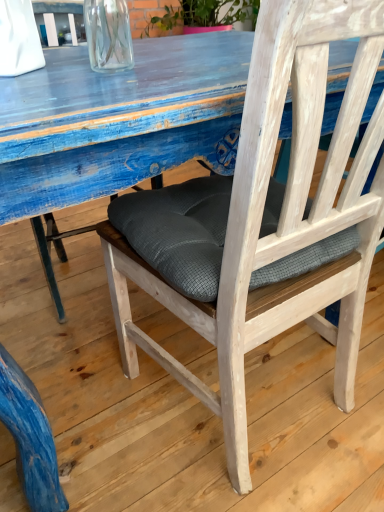
Measure the distance between point (313,224) and camera.

Point (313,224) is 26.10 inches away from camera.

Locate an element on the screen. The image size is (384, 512). wooden chair with cushion at center is located at coordinates (279, 215).

What do you see at coordinates (279, 215) in the screenshot?
I see `wooden chair with cushion at center` at bounding box center [279, 215].

Where is `wooden chair with cushion at center`? The width and height of the screenshot is (384, 512). wooden chair with cushion at center is located at coordinates (279, 215).